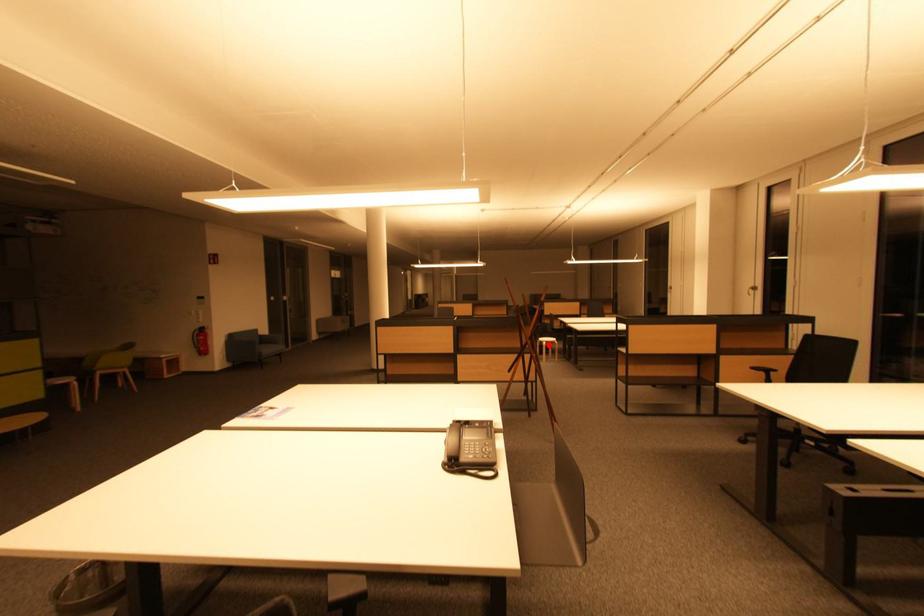
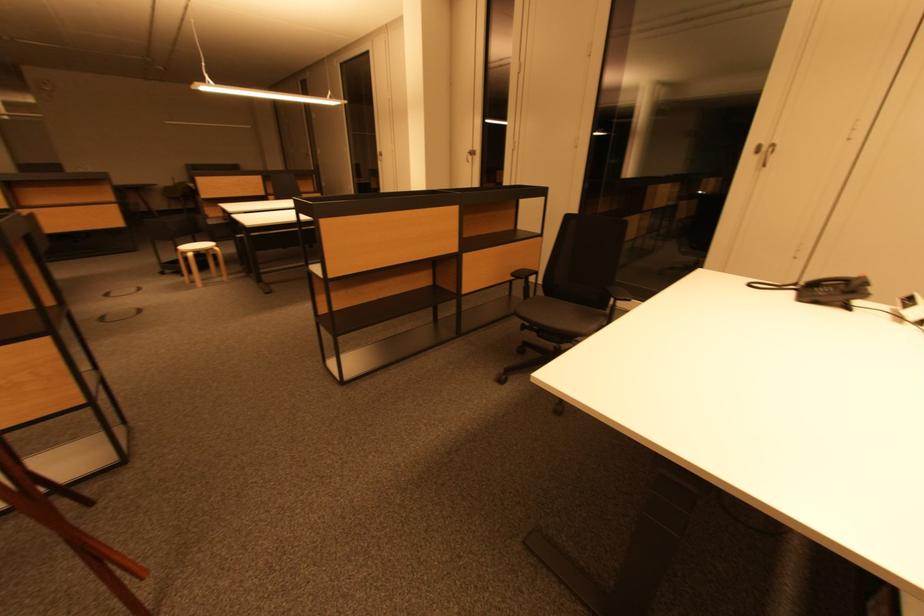
In the second image, find the point that corresponds to the highlighted location in the first image.

(193, 256)